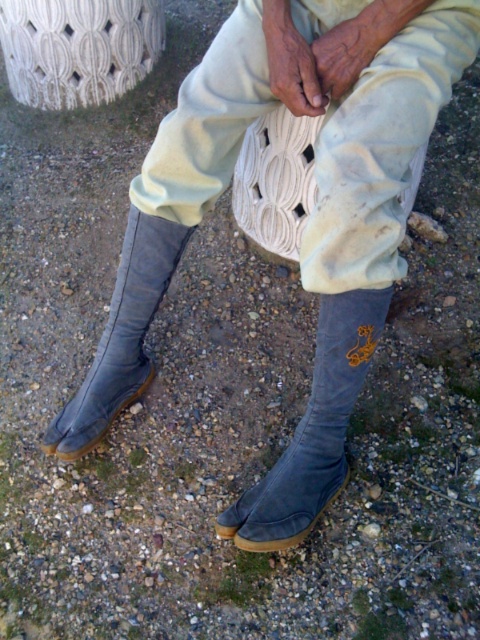
Question: Does suede gray tabi at center appear over gray suede tabi at lower left?

Choices:
 (A) no
 (B) yes

Answer: (A)

Question: Does suede gray tabi at center appear on the left side of gray suede tabi at lower left?

Choices:
 (A) no
 (B) yes

Answer: (A)

Question: Among these points, which one is farthest from the camera?

Choices:
 (A) (309, 525)
 (B) (132, 294)

Answer: (B)

Question: From the image, what is the correct spatial relationship of suede gray tabi at center in relation to gray suede tabi at lower left?

Choices:
 (A) left
 (B) right

Answer: (B)

Question: Which object is closer to the camera taking this photo?

Choices:
 (A) gray suede tabi at lower left
 (B) suede gray tabi at center

Answer: (B)

Question: Which of the following is the farthest from the observer?

Choices:
 (A) suede gray tabi at center
 (B) gray suede tabi at lower left

Answer: (B)